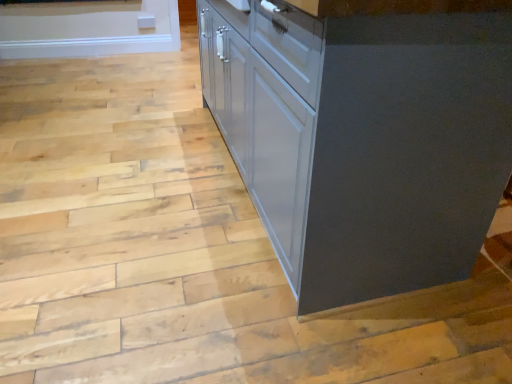
You are a GUI agent. You are given a task and a screenshot of the screen. Output one action in this format:
    pyautogui.click(x=<x>, y=<y>)
    Task: Click on the satin gray cabinet at center
    
    Given the screenshot: What is the action you would take?
    pyautogui.click(x=362, y=139)

Describe the element at coordinates (362, 139) in the screenshot. I see `satin gray cabinet at center` at that location.

What is the approximate width of satin gray cabinet at center?

satin gray cabinet at center is 36.56 inches wide.

Measure the distance between point (494, 44) and camera.

Point (494, 44) and camera are 38.27 inches apart.

Locate an element on the screen. Image resolution: width=512 pixels, height=384 pixels. satin gray cabinet at center is located at coordinates (362, 139).